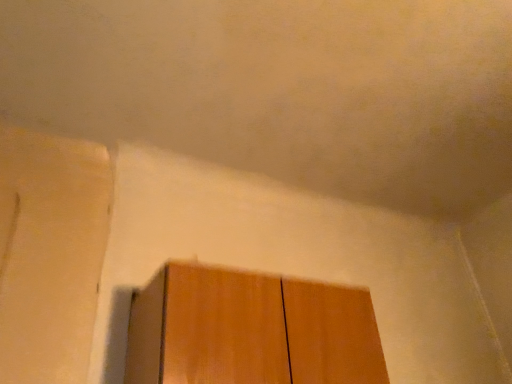
The height and width of the screenshot is (384, 512). What are the coordinates of `wooden plank at lower center` in the screenshot? It's located at (250, 331).

What is the approximate width of wooden plank at lower center?

wooden plank at lower center is 12.90 inches in width.

What do you see at coordinates (250, 331) in the screenshot?
I see `wooden plank at lower center` at bounding box center [250, 331].

You are a GUI agent. You are given a task and a screenshot of the screen. Output one action in this format:
    pyautogui.click(x=<x>, y=<y>)
    Task: Click on the wooden plank at lower center
    The height and width of the screenshot is (384, 512).
    Given the screenshot: What is the action you would take?
    pyautogui.click(x=250, y=331)